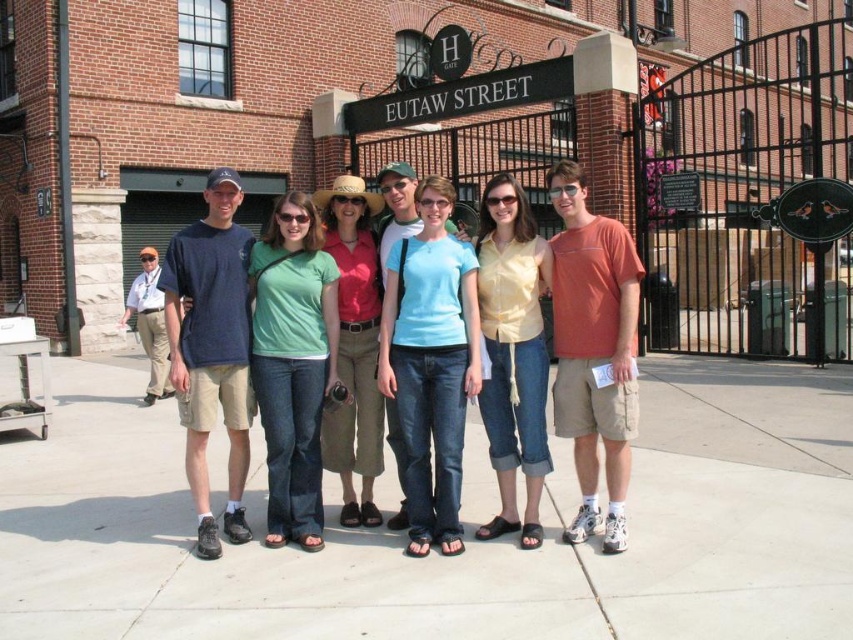
This screenshot has width=853, height=640. What do you see at coordinates (430, 365) in the screenshot? I see `light blue denim jeans at center` at bounding box center [430, 365].

Which is above, light blue denim jeans at center or khaki pants at left?

khaki pants at left is higher up.

Measure the distance between light blue denim jeans at center and camera.

light blue denim jeans at center is 5.86 meters from camera.

The height and width of the screenshot is (640, 853). In order to click on light blue denim jeans at center in this screenshot , I will do `click(430, 365)`.

Is light blue denim jeans at center further to the viewer compared to dark blue t-shirt at left?

No, light blue denim jeans at center is closer to the viewer.

Between light blue denim jeans at center and dark blue t-shirt at left, which one appears on the right side from the viewer's perspective?

light blue denim jeans at center

Locate an element on the screen. light blue denim jeans at center is located at coordinates (430, 365).

Is yellow cotton shirt at center further to camera compared to matte pink shirt at center?

No, it is not.

Is yellow cotton shirt at center to the right of matte pink shirt at center from the viewer's perspective?

Yes, yellow cotton shirt at center is to the right of matte pink shirt at center.

Between point (502, 518) and point (375, 342), which one is positioned behind?

Point (375, 342)

Where is `yellow cotton shirt at center`? Image resolution: width=853 pixels, height=640 pixels. yellow cotton shirt at center is located at coordinates (514, 353).